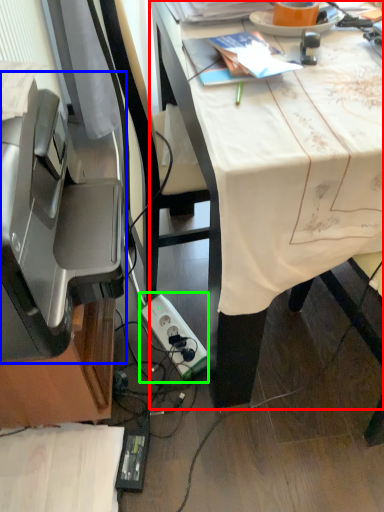
Question: Considering the real-world distances, which object is farthest from desk (highlighted by a red box)? printer (highlighted by a blue box) or power plugs and sockets (highlighted by a green box)?

Choices:
 (A) printer
 (B) power plugs and sockets

Answer: (B)